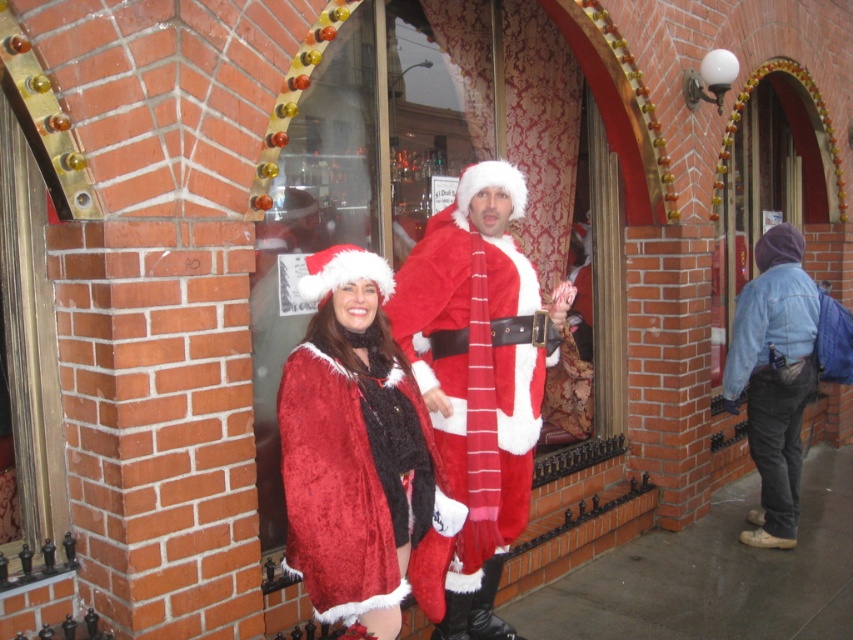
You are standing in front of the festive building and notice the fuzzy red coat at center. Can you determine its exact position using the coordinate system provided?

The fuzzy red coat at center is located at point (x=354, y=449) according to the coordinate system provided.

You are standing in front of the festive building with the arched windows. You want to take a photo of the fuzzy red coat at center without including the building in the background. Based on its distance, can you estimate if you need to move closer or farther away to frame the coat properly?

The fuzzy red coat at center is 7.61 feet from the camera. To frame the coat properly without including the building in the background, you should move closer to reduce the background area captured in the photo.

You are a visitor at this festive event and want to take a photo of both the velvet santa suit at center and the fuzzy red coat at center. Since you want them both in the frame, which one should you position closer to the left side of your camera viewfinder?

The fuzzy red coat at center should be positioned closer to the left side of the camera viewfinder because the velvet santa suit at center is already to the right of it.